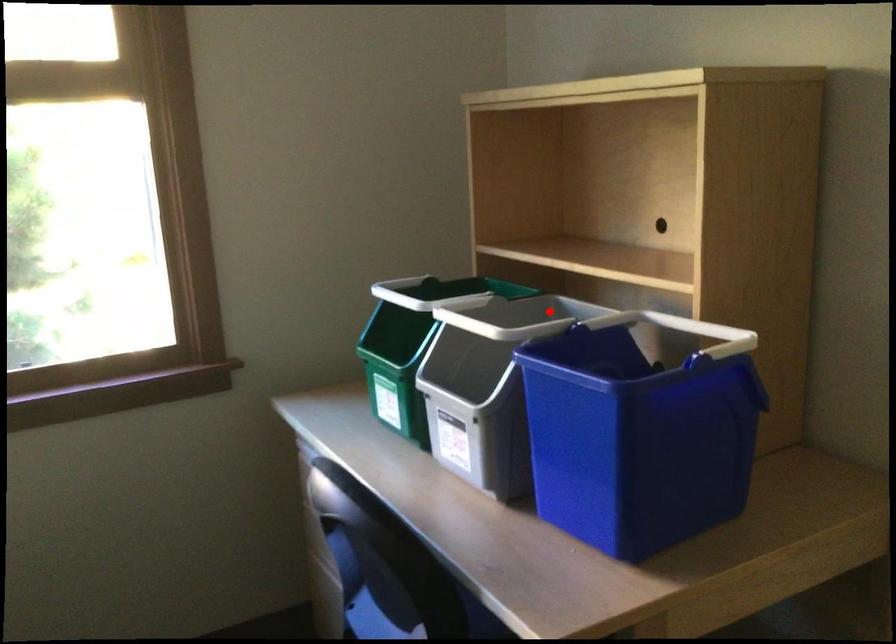
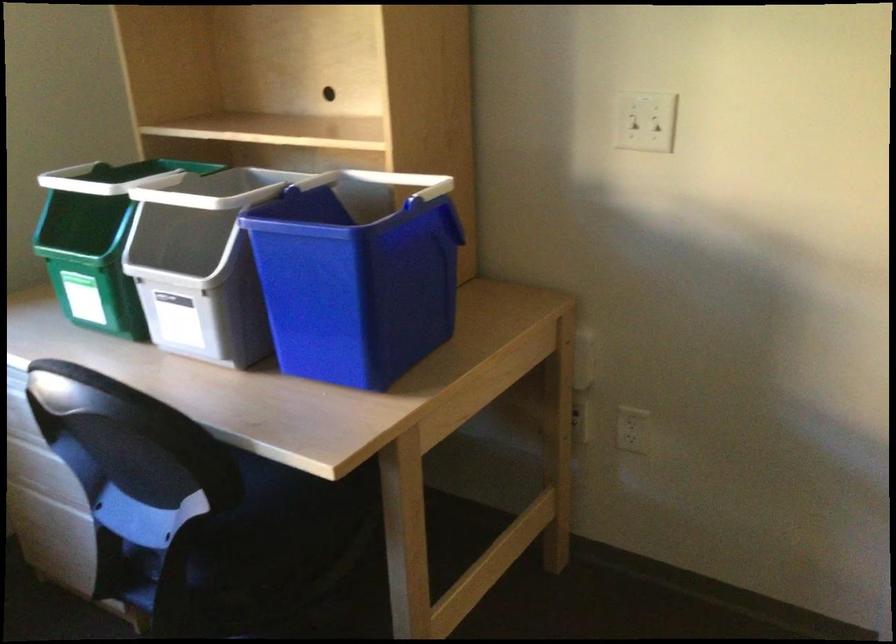
In the second image, find the point that corresponds to the highlighted location in the first image.

(245, 185)